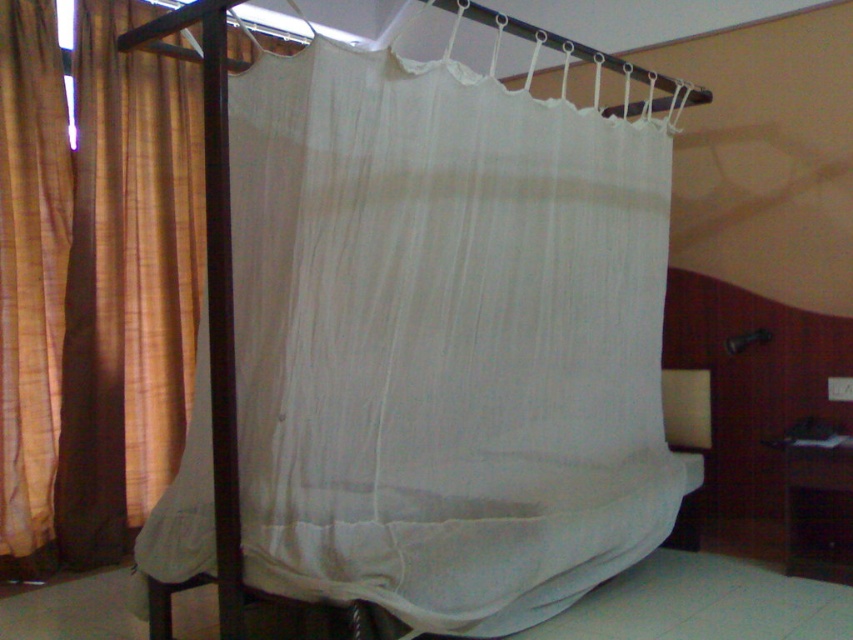
Is point (242, 237) more distant than point (0, 378)?

No, (242, 237) is in front of (0, 378).

Between white cotton sheet at center and brown textured fabric at left, which one has more height?

brown textured fabric at left

Does point (585, 589) come farther from viewer compared to point (22, 321)?

No, (585, 589) is in front of (22, 321).

Image resolution: width=853 pixels, height=640 pixels. I want to click on white cotton sheet at center, so click(x=444, y=339).